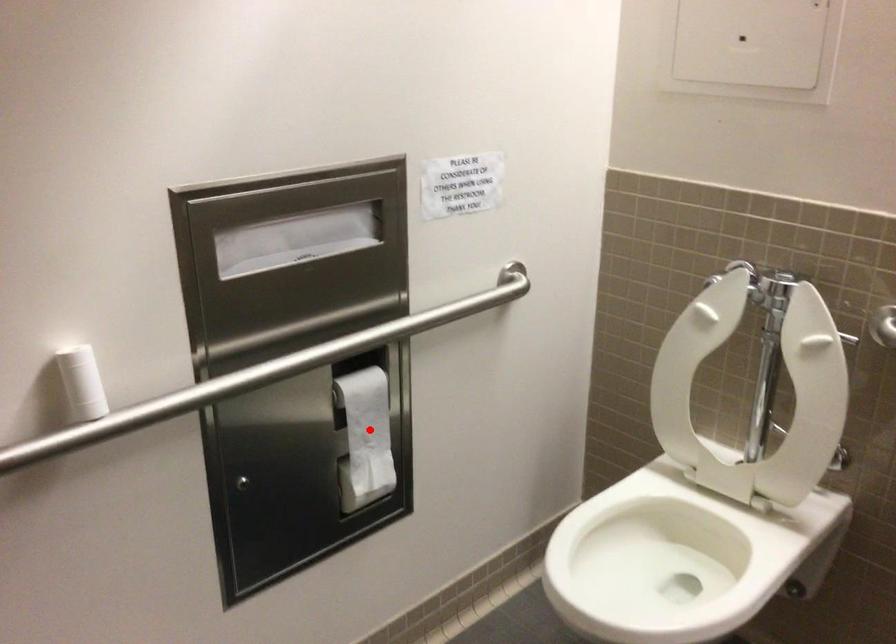
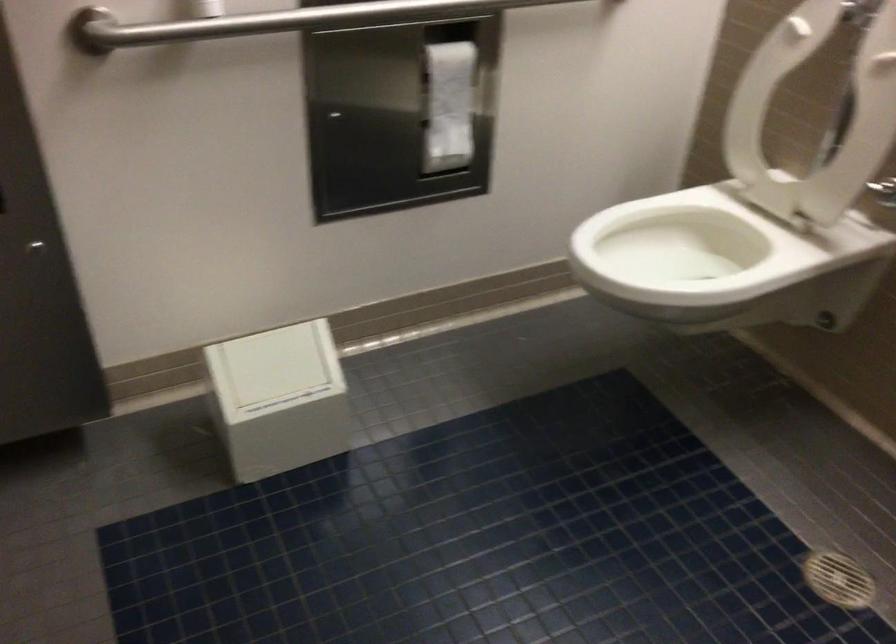
Locate, in the second image, the point that corresponds to the highlighted location in the first image.

(450, 98)